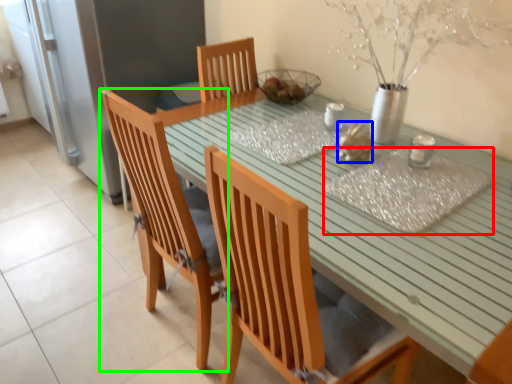
Question: Based on their relative distances, which object is farther from place mat (highlighted by a red box)? Choose from food (highlighted by a blue box) and chair (highlighted by a green box).

Choices:
 (A) food
 (B) chair

Answer: (B)